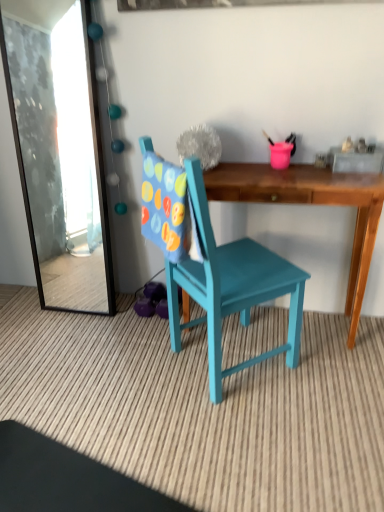
In order to face transparent glass mirror at upper left, should I rotate leftwards or rightwards?

Rotate your view left by about 16.631°.

This screenshot has height=512, width=384. Find the location of `wooden desk at center`. wooden desk at center is located at coordinates (313, 204).

In order to face wooden desk at center, should I rotate leftwards or rightwards?

Turn right approximately 11.808 degrees to face it.

Locate an element on the screen. The width and height of the screenshot is (384, 512). transparent glass mirror at upper left is located at coordinates (60, 158).

Between teal painted wood chair at center and transparent glass mirror at upper left, which one appears on the left side from the viewer's perspective?

transparent glass mirror at upper left.

Between teal painted wood chair at center and transparent glass mirror at upper left, which one has more height?

With more height is teal painted wood chair at center.

From a real-world perspective, is teal painted wood chair at center positioned over transparent glass mirror at upper left based on gravity?

No.

At what (x,y) coordinates should I click in order to perform the action: click on mirror on the left of the teal painted wood chair at center. Please return your answer as a coordinate pair (x, y). Looking at the image, I should click on (60, 158).

Which of these two, wooden desk at center or teal painted wood chair at center, stands taller?

teal painted wood chair at center is taller.

Which object is closer to the camera taking this photo, wooden desk at center or teal painted wood chair at center?

Positioned in front is teal painted wood chair at center.

Is point (280, 196) closer or farther from the camera than point (216, 391)?

Point (280, 196) is positioned farther from the camera compared to point (216, 391).

Is wooden desk at center in front of or behind transparent glass mirror at upper left in the image?

Clearly, wooden desk at center is in front of transparent glass mirror at upper left.

Considering the relative sizes of wooden desk at center and transparent glass mirror at upper left in the image provided, is wooden desk at center bigger than transparent glass mirror at upper left?

Yes, wooden desk at center is bigger than transparent glass mirror at upper left.

Considering the relative sizes of wooden desk at center and transparent glass mirror at upper left in the image provided, is wooden desk at center wider than transparent glass mirror at upper left?

Yes, wooden desk at center is wider than transparent glass mirror at upper left.

Which is more to the left, wooden desk at center or transparent glass mirror at upper left?

From the viewer's perspective, transparent glass mirror at upper left appears more on the left side.

Is transparent glass mirror at upper left closer to the viewer compared to teal painted wood chair at center?

No, transparent glass mirror at upper left is further to the viewer.

Does transparent glass mirror at upper left have a lesser height compared to teal painted wood chair at center?

Correct, transparent glass mirror at upper left is not as tall as teal painted wood chair at center.

Measure the distance between transparent glass mirror at upper left and teal painted wood chair at center.

A distance of 1.12 meters exists between transparent glass mirror at upper left and teal painted wood chair at center.

Find the location of a particular element. chair below the transparent glass mirror at upper left (from the image's perspective) is located at coordinates click(231, 287).

Which object is further away from the camera taking this photo, transparent glass mirror at upper left or wooden desk at center?

transparent glass mirror at upper left.

Can you tell me how much transparent glass mirror at upper left and wooden desk at center differ in facing direction?

0.658 degrees.

From a real-world perspective, is transparent glass mirror at upper left on top of wooden desk at center?

Indeed, from a real-world perspective, transparent glass mirror at upper left stands above wooden desk at center.

Is teal painted wood chair at center touching wooden desk at center?

No, teal painted wood chair at center is not in contact with wooden desk at center.

Would you say teal painted wood chair at center is outside wooden desk at center?

teal painted wood chair at center is positioned outside wooden desk at center.

Is teal painted wood chair at center to the right of wooden desk at center from the viewer's perspective?

No, teal painted wood chair at center is not to the right of wooden desk at center.

Which object is closer to the camera taking this photo, teal painted wood chair at center or wooden desk at center?

teal painted wood chair at center is in front.

Locate an element on the screen. mirror above the teal painted wood chair at center (from the image's perspective) is located at coordinates (60, 158).

Where is `desk beneath the teal painted wood chair at center (from a real-world perspective)`? Image resolution: width=384 pixels, height=512 pixels. desk beneath the teal painted wood chair at center (from a real-world perspective) is located at coordinates (313, 204).

Looking at the image, which one is located closer to wooden desk at center, teal painted wood chair at center or transparent glass mirror at upper left?

teal painted wood chair at center.

Based on their spatial positions, is transparent glass mirror at upper left or wooden desk at center further from teal painted wood chair at center?

Based on the image, transparent glass mirror at upper left appears to be further to teal painted wood chair at center.

When comparing their distances from wooden desk at center, does transparent glass mirror at upper left or teal painted wood chair at center seem further?

The object further to wooden desk at center is transparent glass mirror at upper left.

From the image, which object appears to be farther from transparent glass mirror at upper left, teal painted wood chair at center or wooden desk at center?

wooden desk at center lies further to transparent glass mirror at upper left than the other object.

Based on their spatial positions, is wooden desk at center or teal painted wood chair at center further from transparent glass mirror at upper left?

wooden desk at center lies further to transparent glass mirror at upper left than the other object.

Estimate the real-world distances between objects in this image. Which object is further from teal painted wood chair at center, wooden desk at center or transparent glass mirror at upper left?

Among the two, transparent glass mirror at upper left is located further to teal painted wood chair at center.

Locate an element on the screen. Image resolution: width=384 pixels, height=512 pixels. chair between transparent glass mirror at upper left and wooden desk at center in the horizontal direction is located at coordinates (231, 287).